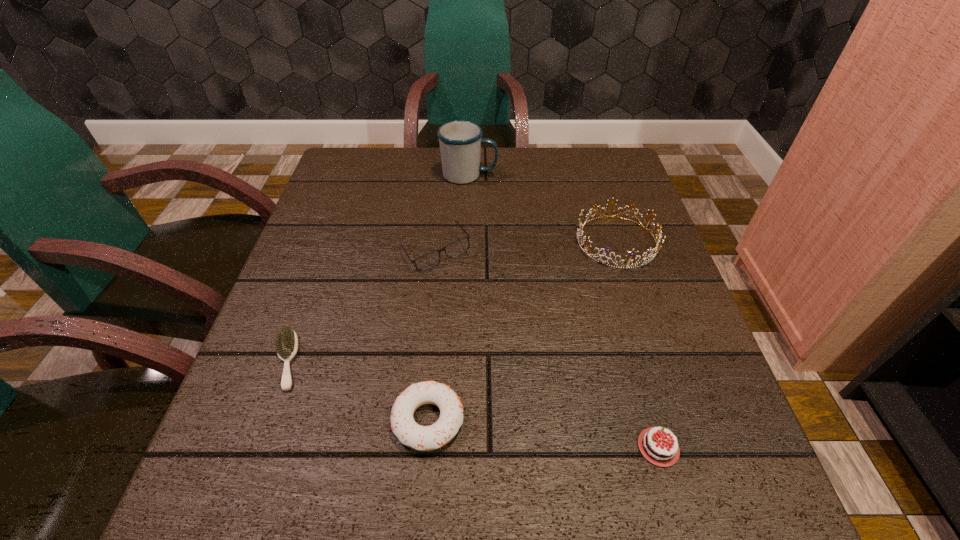
In the image, there is a desktop. Where is `free region at the far edge`? The height and width of the screenshot is (540, 960). free region at the far edge is located at coordinates (492, 157).

This screenshot has width=960, height=540. Identify the location of free spot at the near edge of the desktop. (489, 475).

This screenshot has width=960, height=540. I want to click on blank space at the left edge, so click(x=321, y=413).

The height and width of the screenshot is (540, 960). In the image, there is a desktop. Find the location of `blank space at the right edge`. blank space at the right edge is located at coordinates (698, 373).

Locate an element on the screen. The height and width of the screenshot is (540, 960). vacant space at the far left corner is located at coordinates (379, 185).

Identify the location of vacant space at the far right corner of the desktop. The height and width of the screenshot is (540, 960). (623, 179).

At what (x,y) coordinates should I click in order to perform the action: click on free space at the near right corner of the desktop. Please return your answer as a coordinate pair (x, y). This screenshot has width=960, height=540. Looking at the image, I should click on (783, 530).

Where is `free space between the tiara and the fifth tallest object`? The width and height of the screenshot is (960, 540). free space between the tiara and the fifth tallest object is located at coordinates (637, 345).

At what (x,y) coordinates should I click in order to perform the action: click on free space between the shortest object and the doughnut. Please return your answer as a coordinate pair (x, y). The width and height of the screenshot is (960, 540). Looking at the image, I should click on (357, 390).

The height and width of the screenshot is (540, 960). I want to click on unoccupied position between the shortest object and the mug, so click(x=377, y=267).